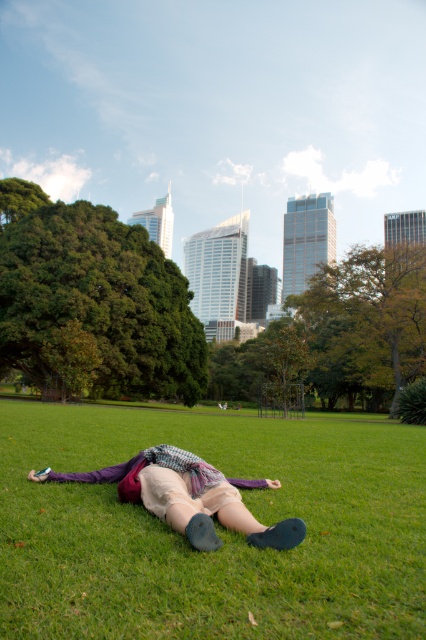
Question: Is green grass at center further to the viewer compared to matte purple sweater at center?

Choices:
 (A) no
 (B) yes

Answer: (A)

Question: Is the position of green grass at center less distant than that of matte purple sweater at center?

Choices:
 (A) yes
 (B) no

Answer: (A)

Question: Among these objects, which one is farthest from the camera?

Choices:
 (A) matte purple sweater at center
 (B) green grass at center

Answer: (A)

Question: Can you confirm if green grass at center is positioned to the left of matte purple sweater at center?

Choices:
 (A) no
 (B) yes

Answer: (A)

Question: Among these objects, which one is nearest to the camera?

Choices:
 (A) matte purple sweater at center
 (B) green grass at center

Answer: (B)

Question: Among these objects, which one is nearest to the camera?

Choices:
 (A) green grass at center
 (B) matte purple sweater at center

Answer: (A)